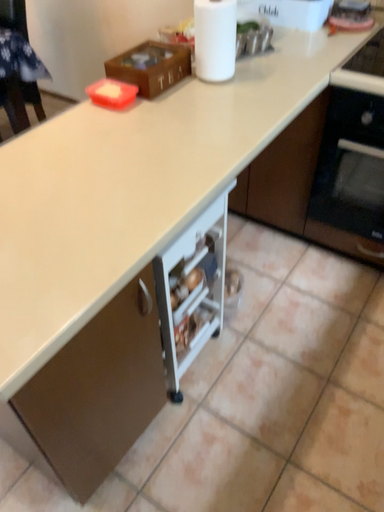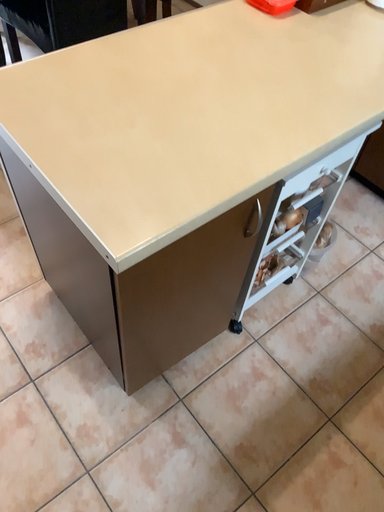
Question: Which way did the camera rotate in the video?

Choices:
 (A) rotated upward
 (B) rotated downward

Answer: (B)